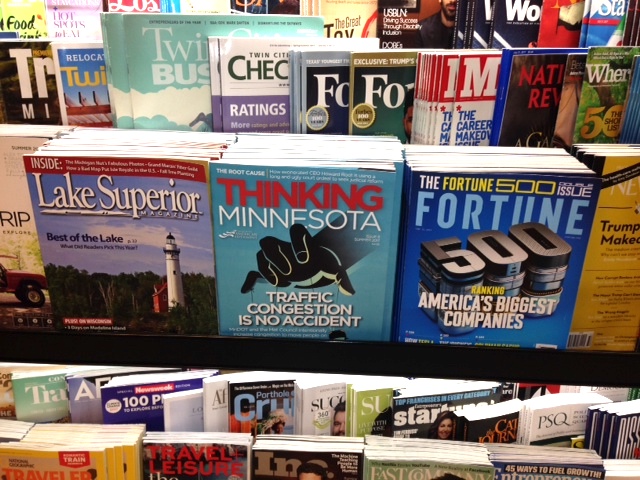
Where is `black shelf`? black shelf is located at coordinates (224, 350).